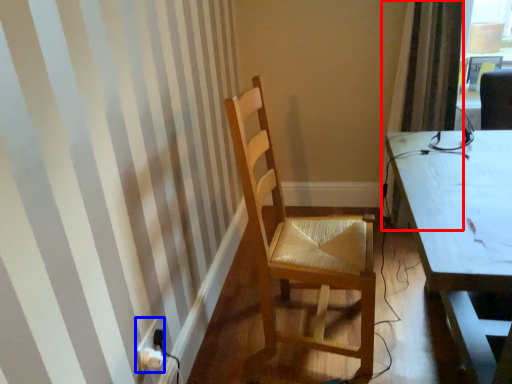
Question: Which object appears closest to the camera in this image, curtain (highlighted by a red box) or power plugs and sockets (highlighted by a blue box)?

Choices:
 (A) curtain
 (B) power plugs and sockets

Answer: (B)